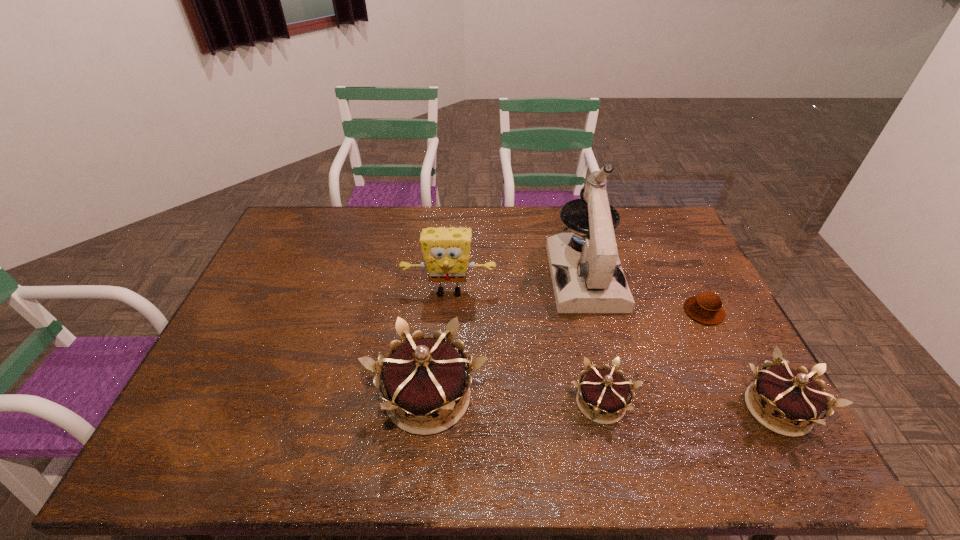
Where is `free space in the image that satisfies the following two spatial constraints: 1. on the front side of the fourth tallest object; 2. on the right side of the second crown from right to left`? free space in the image that satisfies the following two spatial constraints: 1. on the front side of the fourth tallest object; 2. on the right side of the second crown from right to left is located at coordinates (602, 409).

I want to click on vacant point that satisfies the following two spatial constraints: 1. on the face of the sponge; 2. on the right side of the shortest object, so click(447, 311).

Where is `vacant space that satisfies the following two spatial constraints: 1. on the face of the third shortest object; 2. on the right side of the sponge`? vacant space that satisfies the following two spatial constraints: 1. on the face of the third shortest object; 2. on the right side of the sponge is located at coordinates (441, 409).

Identify the location of free space that satisfies the following two spatial constraints: 1. on the front side of the second crown from right to left; 2. on the left side of the leftmost crown. The height and width of the screenshot is (540, 960). (427, 403).

Locate an element on the screen. The width and height of the screenshot is (960, 540). vacant space that satisfies the following two spatial constraints: 1. on the face of the sponge; 2. on the left side of the muffin is located at coordinates (447, 311).